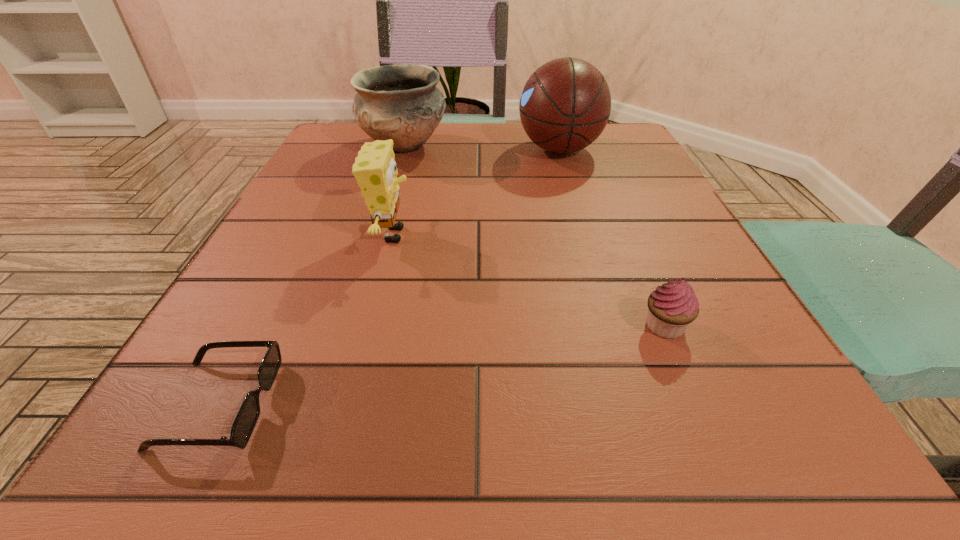
At what (x,y) coordinates should I click in order to perform the action: click on object that can be found as the fourth closest to the shortest object. Please return your answer as a coordinate pair (x, y). The image size is (960, 540). Looking at the image, I should click on tap(565, 105).

Identify the location of vacant area in the image that satisfies the following two spatial constraints: 1. on the front side of the basketball; 2. on the right side of the pottery. The image size is (960, 540). (403, 149).

Identify the location of vacant space that satisfies the following two spatial constraints: 1. on the face of the cupcake; 2. on the left side of the sponge. Image resolution: width=960 pixels, height=540 pixels. (370, 326).